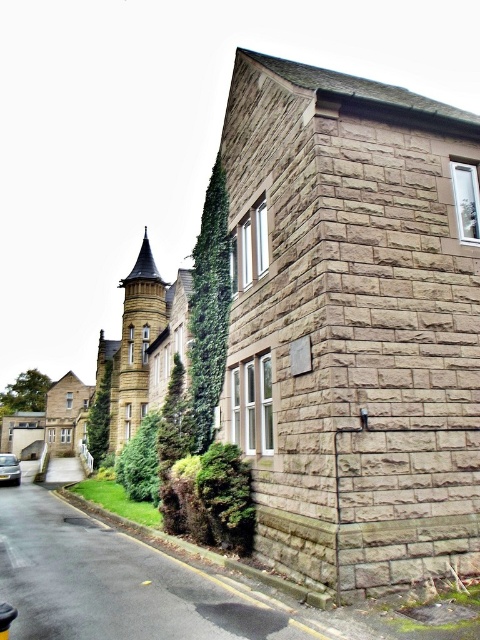
You are standing in front of the building and notice the green leafy ivy at center and the silver metallic car at lower left. Which object is positioned higher relative to the other?

The green leafy ivy at center is located above the silver metallic car at lower left, so it is positioned higher.

You are standing in front of the building and notice two areas of green ivy. The first is the green leafy ivy at lower left, and the second is the green ivy at left. Which of these ivy areas is closer to you?

The green leafy ivy at lower left is closer to you because it is in front of the green ivy at left.

You are standing in front of the building and want to take a photo of the green ivy at left. Where should you position yourself to capture it in the frame?

To capture the green ivy at left in the frame, position yourself so that the ivy is centered at the coordinates approximately 0.653 on the horizontal axis and 0.208 on the vertical axis relative to the building facade.